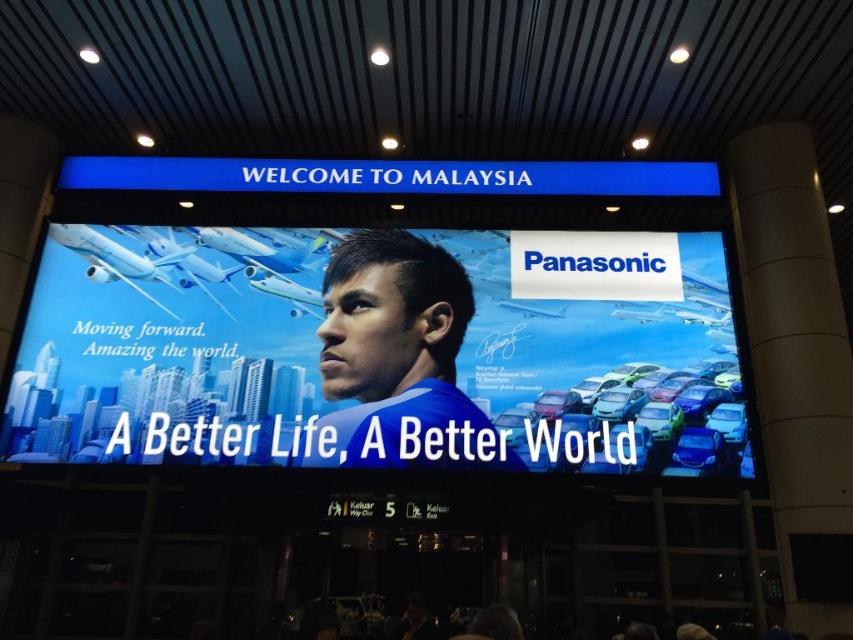
Question: Where is blue fabric at center located in relation to blue metallic signboard at upper center in the image?

Choices:
 (A) below
 (B) above

Answer: (A)

Question: Estimate the real-world distances between objects in this image. Which object is farther from the blue metallic signboard at upper center?

Choices:
 (A) blue glossy billboard at center
 (B) blue fabric at center

Answer: (B)

Question: Does blue glossy billboard at center have a smaller size compared to blue metallic signboard at upper center?

Choices:
 (A) no
 (B) yes

Answer: (A)

Question: Which point appears closest to the camera in this image?

Choices:
 (A) (332, 305)
 (B) (151, 346)
 (C) (581, 193)

Answer: (B)

Question: Which point is closer to the camera?

Choices:
 (A) (395, 403)
 (B) (73, 264)

Answer: (A)

Question: Can you confirm if blue fabric at center is positioned above blue metallic signboard at upper center?

Choices:
 (A) no
 (B) yes

Answer: (A)